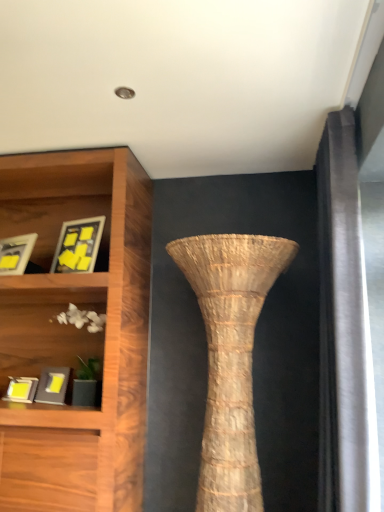
Question: Is matte black picture frame at lower left, the 1th picture frame from the bottom, at the right side of natural woven vase at center?

Choices:
 (A) no
 (B) yes

Answer: (A)

Question: Does matte black picture frame at lower left, the 4th picture frame when ordered from top to bottom, have a greater width compared to natural woven vase at center?

Choices:
 (A) yes
 (B) no

Answer: (B)

Question: Is matte black picture frame at lower left, the 4th picture frame when ordered from top to bottom, taller than natural woven vase at center?

Choices:
 (A) yes
 (B) no

Answer: (B)

Question: Is matte black picture frame at lower left, the 4th picture frame when ordered from top to bottom, not near natural woven vase at center?

Choices:
 (A) yes
 (B) no

Answer: (A)

Question: Is matte black picture frame at lower left, the 4th picture frame when ordered from top to bottom, closer to camera compared to natural woven vase at center?

Choices:
 (A) yes
 (B) no

Answer: (B)

Question: Is matte black picture frame at lower left, the 4th picture frame when ordered from top to bottom, facing away from natural woven vase at center?

Choices:
 (A) no
 (B) yes

Answer: (A)

Question: Can you see matte black picture frame at lower left, placed as the second picture frame when sorted from bottom to top, touching matte black picture frame at lower left, the 4th picture frame when ordered from top to bottom?

Choices:
 (A) yes
 (B) no

Answer: (B)

Question: Is matte black picture frame at lower left, the third picture frame viewed from the top, at the left side of matte black picture frame at lower left, the 1th picture frame from the bottom?

Choices:
 (A) no
 (B) yes

Answer: (A)

Question: From the image's perspective, is matte black picture frame at lower left, the third picture frame viewed from the top, located above matte black picture frame at lower left, the 1th picture frame from the bottom?

Choices:
 (A) yes
 (B) no

Answer: (A)

Question: Does matte black picture frame at lower left, the third picture frame viewed from the top, have a larger size compared to matte black picture frame at lower left, the 1th picture frame from the bottom?

Choices:
 (A) yes
 (B) no

Answer: (A)

Question: Considering the relative sizes of matte black picture frame at lower left, the third picture frame viewed from the top, and matte black picture frame at lower left, the 4th picture frame when ordered from top to bottom, in the image provided, is matte black picture frame at lower left, the third picture frame viewed from the top, taller than matte black picture frame at lower left, the 4th picture frame when ordered from top to bottom,?

Choices:
 (A) yes
 (B) no

Answer: (A)

Question: From the image's perspective, is matte black picture frame at lower left, placed as the second picture frame when sorted from bottom to top, under matte black picture frame at lower left, the 1th picture frame from the bottom?

Choices:
 (A) yes
 (B) no

Answer: (B)

Question: From a real-world perspective, is natural woven vase at center on top of matte yellow picture frame at left, which is the 3th picture frame from bottom to top?

Choices:
 (A) yes
 (B) no

Answer: (B)